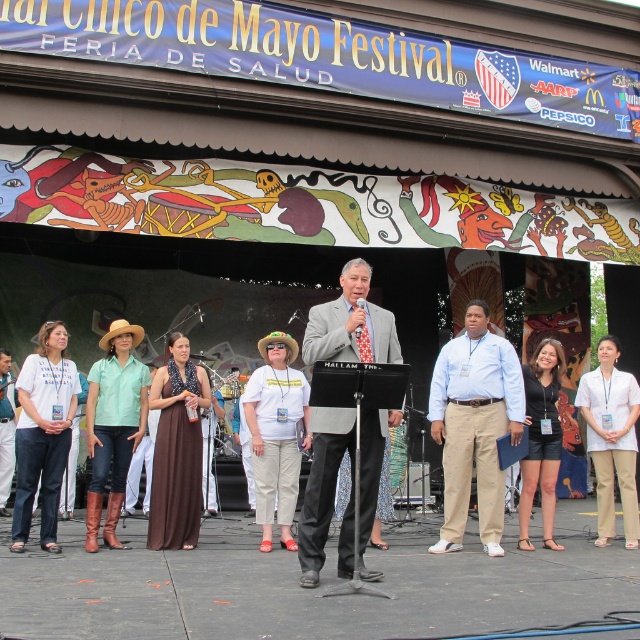
You are attending the Feria de Mayo Festival and notice two items on the stage. The light blue shirt at center and the white smooth pants at center. Which item is located to the left of the other?

The light blue shirt at center is positioned on the left side of white smooth pants at center.